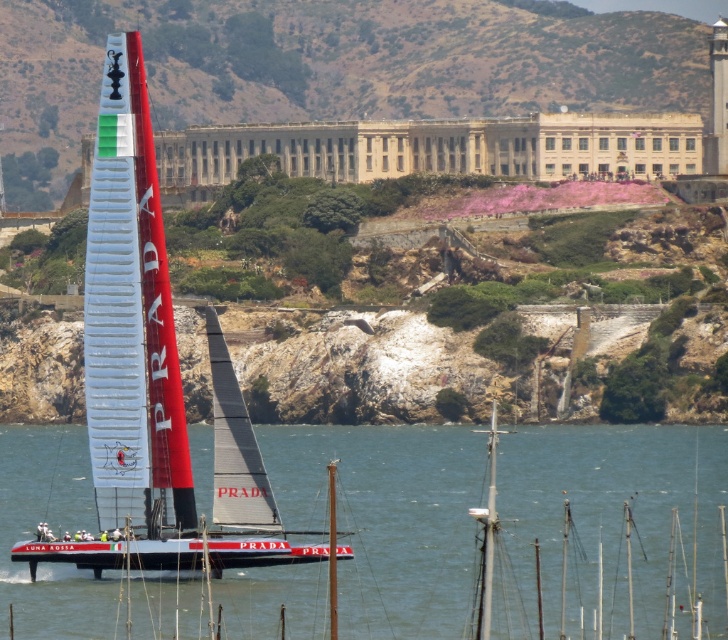
Question: Can you confirm if transparent water at center is thinner than white glossy sailboat at center?

Choices:
 (A) no
 (B) yes

Answer: (A)

Question: Considering the relative positions of transparent water at center and white glossy sailboat at center in the image provided, where is transparent water at center located with respect to white glossy sailboat at center?

Choices:
 (A) right
 (B) left

Answer: (A)

Question: Can you confirm if transparent water at center is thinner than white glossy sailboat at center?

Choices:
 (A) no
 (B) yes

Answer: (A)

Question: Which of the following is the farthest from the observer?

Choices:
 (A) transparent water at center
 (B) white glossy sailboat at center

Answer: (A)